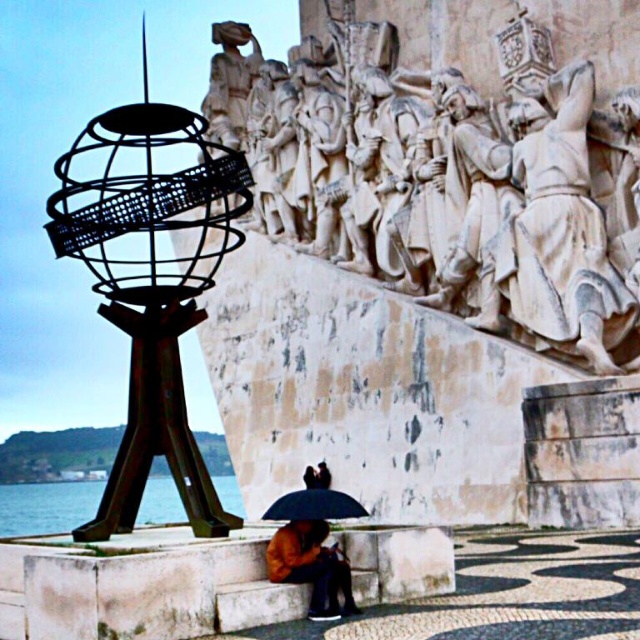
Based on the photo, is blue water at lower left thinner than brown leather jacket at lower center?

No, blue water at lower left is not thinner than brown leather jacket at lower center.

Who is lower down, blue water at lower left or brown leather jacket at lower center?

Positioned lower is blue water at lower left.

Does point (227, 493) come farther from viewer compared to point (307, 532)?

Yes, it is behind point (307, 532).

Find the location of a particular element. The height and width of the screenshot is (640, 640). blue water at lower left is located at coordinates (45, 506).

Which is more to the right, white stone carving at upper center or black matte umbrella at lower center?

From the viewer's perspective, white stone carving at upper center appears more on the right side.

Measure the distance between white stone carving at upper center and camera.

They are 178.46 feet apart.

This screenshot has height=640, width=640. I want to click on white stone carving at upper center, so click(x=456, y=157).

Between white stone carving at upper center and brown leather jacket at lower center, which one is positioned higher?

white stone carving at upper center is above.

Who is shorter, white stone carving at upper center or brown leather jacket at lower center?

With less height is brown leather jacket at lower center.

Does point (524, 244) come in front of point (298, 529)?

No, (524, 244) is further to viewer.

Locate an element on the screen. The height and width of the screenshot is (640, 640). white stone carving at upper center is located at coordinates (456, 157).